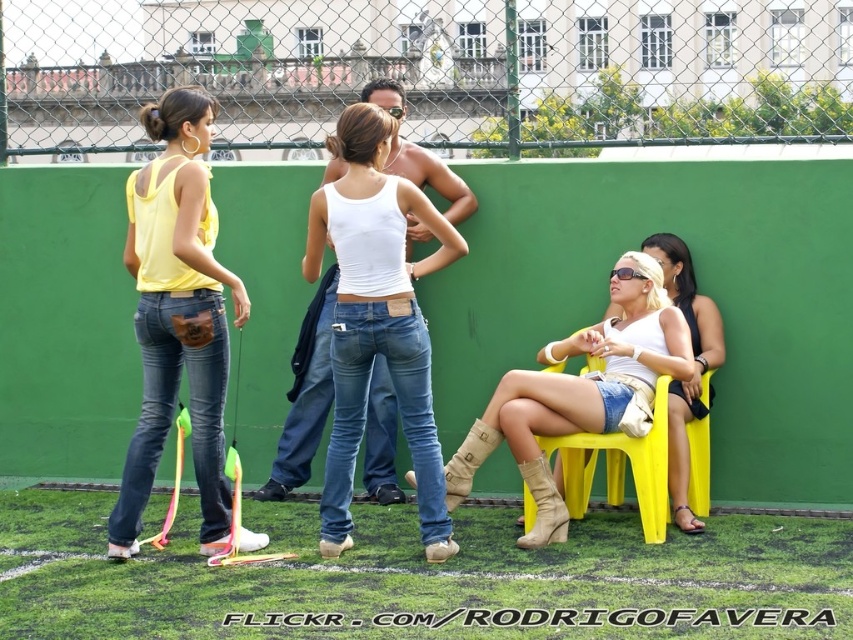
Question: Which point is closer to the camera?

Choices:
 (A) (660, 296)
 (B) (527, 486)

Answer: (B)

Question: Is white matte tank top at center closer to the viewer compared to matte white tank top at right?

Choices:
 (A) no
 (B) yes

Answer: (B)

Question: Which point is closer to the camera taking this photo?

Choices:
 (A) (635, 291)
 (B) (310, 280)

Answer: (A)

Question: Considering the relative positions of suede beige boot at lower center and leather boots at lower center in the image provided, where is suede beige boot at lower center located with respect to leather boots at lower center?

Choices:
 (A) below
 (B) above

Answer: (A)

Question: Does white matte tank top at center lie in front of matte white tank top at right?

Choices:
 (A) yes
 (B) no

Answer: (A)

Question: Which point is closer to the camera?

Choices:
 (A) (618, 298)
 (B) (155, 200)
 (C) (553, 484)

Answer: (C)